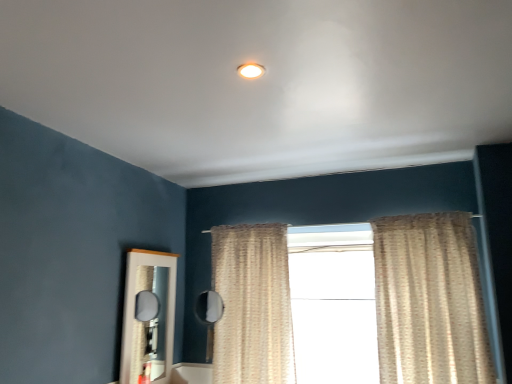
Question: Is white glossy mirror at lower left bigger or smaller than beige textured curtain at right, positioned as the 2th curtain in left-to-right order?

Choices:
 (A) small
 (B) big

Answer: (A)

Question: Considering their positions, is white glossy mirror at lower left located in front of or behind beige textured curtain at right, positioned as the 2th curtain in left-to-right order?

Choices:
 (A) front
 (B) behind

Answer: (B)

Question: Which of these objects is positioned closest to the beige textured curtain at right, which is the 1th curtain from right to left?

Choices:
 (A) matte white light fixture at upper center
 (B) white sheer curtains at center
 (C) white glossy mirror at lower left
 (D) beige textured curtain at center, arranged as the first curtain when viewed from the left
 (E) matte blue wall at left

Answer: (B)

Question: Which of these objects is positioned farthest from the white glossy mirror at lower left?

Choices:
 (A) matte white light fixture at upper center
 (B) white sheer curtains at center
 (C) beige textured curtain at right, which is the 1th curtain from right to left
 (D) beige textured curtain at center, arranged as the first curtain when viewed from the left
 (E) matte blue wall at left

Answer: (A)